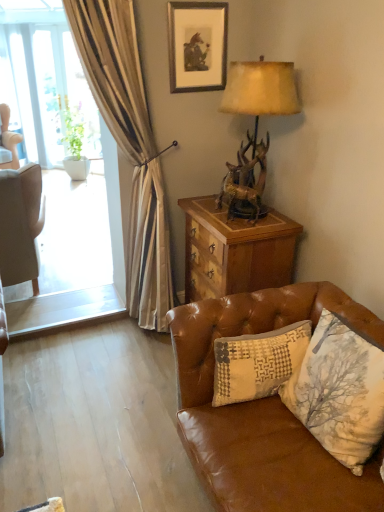
Locate an element on the screen. white fabric chair at left, the second chair when ordered from bottom to top is located at coordinates (9, 139).

From the picture: In order to face antler-patterned wood lamp at upper right, should I rotate leftwards or rightwards?

You should rotate right by 8.635 degrees.

This screenshot has width=384, height=512. I want to click on antler-patterned wood lamp at upper right, so pyautogui.click(x=261, y=90).

What do you see at coordinates (20, 224) in the screenshot?
I see `light brown leather chair at left, which is the second chair from left to right` at bounding box center [20, 224].

The image size is (384, 512). I want to click on matte black picture frame at upper center, so click(x=197, y=46).

The width and height of the screenshot is (384, 512). What do you see at coordinates (263, 410) in the screenshot?
I see `brown leather couch at lower right` at bounding box center [263, 410].

Locate an element on the screen. white fabric chair at left, the second chair when ordered from bottom to top is located at coordinates (9, 139).

Is wooden chest at right inside brown leather couch at lower right?

Actually, wooden chest at right is outside brown leather couch at lower right.

Does brown leather couch at lower right have a larger size compared to wooden chest at right?

Correct, brown leather couch at lower right is larger in size than wooden chest at right.

Is the surface of brown leather couch at lower right in direct contact with wooden chest at right?

No, brown leather couch at lower right is not next to wooden chest at right.

Based on the photo, can you confirm if green leafy plant at left is smaller than light brown leather chair at left, placed as the 1th chair when sorted from right to left?

Yes.

Does green leafy plant at left lie in front of light brown leather chair at left, placed as the 1th chair when sorted from right to left?

No, it is not.

Who is taller, green leafy plant at left or light brown leather chair at left, the first chair in the bottom-to-top sequence?

With more height is green leafy plant at left.

Considering the points (66, 163) and (20, 181), which point is in front, point (66, 163) or point (20, 181)?

The point (20, 181) is in front.

Considering the points (268, 497) and (4, 144), which point is in front, point (268, 497) or point (4, 144)?

The point (268, 497) is more forward.

From a real-world perspective, is brown leather couch at lower right positioned over white fabric chair at left, which is the first chair in left-to-right order, based on gravity?

No, from a real-world perspective, brown leather couch at lower right is not above white fabric chair at left, which is the first chair in left-to-right order.

Is brown leather couch at lower right taller or shorter than white fabric chair at left, the 1th chair positioned from the back?

Considering their sizes, brown leather couch at lower right has less height than white fabric chair at left, the 1th chair positioned from the back.

Which object is more forward, brown leather couch at lower right or white fabric chair at left, the second chair viewed from the right?

brown leather couch at lower right is in front.

Measure the distance between patchwork fabric pillow at lower right and wooden chest at right.

patchwork fabric pillow at lower right and wooden chest at right are 24.42 inches apart from each other.

From the image's perspective, relative to wooden chest at right, is patchwork fabric pillow at lower right above or below?

Clearly, from the image's perspective, patchwork fabric pillow at lower right is below wooden chest at right.

Locate an element on the screen. The image size is (384, 512). pillow in front of the wooden chest at right is located at coordinates (257, 362).

Which object is further away from the camera taking this photo, patchwork fabric pillow at lower right or wooden chest at right?

wooden chest at right is behind.

Where is `picture frame that appears above the light brown leather chair at left, which ranks as the 2th chair in back-to-front order (from a real-world perspective)`? This screenshot has width=384, height=512. picture frame that appears above the light brown leather chair at left, which ranks as the 2th chair in back-to-front order (from a real-world perspective) is located at coordinates (197, 46).

Is matte black picture frame at upper center beside light brown leather chair at left, placed as the 1th chair when sorted from right to left?

No, matte black picture frame at upper center is not making contact with light brown leather chair at left, placed as the 1th chair when sorted from right to left.

Could you measure the distance between matte black picture frame at upper center and light brown leather chair at left, which is the second chair from left to right?

4.41 feet.

Can you confirm if matte black picture frame at upper center is bigger than light brown leather chair at left, the first chair in the bottom-to-top sequence?

Incorrect, matte black picture frame at upper center is not larger than light brown leather chair at left, the first chair in the bottom-to-top sequence.

Does brown leather couch at lower right contain antler-patterned wood lamp at upper right?

Definitely not — antler-patterned wood lamp at upper right is not inside brown leather couch at lower right.

From a real-world perspective, who is located higher, brown leather couch at lower right or antler-patterned wood lamp at upper right?

antler-patterned wood lamp at upper right.

In terms of width, does brown leather couch at lower right look wider or thinner when compared to antler-patterned wood lamp at upper right?

In the image, brown leather couch at lower right appears to be wider than antler-patterned wood lamp at upper right.

From the picture: Is brown leather couch at lower right beside antler-patterned wood lamp at upper right?

brown leather couch at lower right and antler-patterned wood lamp at upper right are clearly separated.

What are the coordinates of `picture frame behind the antler-patterned wood lamp at upper right` in the screenshot? It's located at (197, 46).

Does matte black picture frame at upper center have a lesser height compared to antler-patterned wood lamp at upper right?

Yes.

Does matte black picture frame at upper center lie in front of antler-patterned wood lamp at upper right?

No, it is behind antler-patterned wood lamp at upper right.

Locate an element on the screen. desk above the brown leather couch at lower right (from a real-world perspective) is located at coordinates (235, 250).

Locate an element on the screen. houseplant that appears above the light brown leather chair at left, the 2th chair when ordered from top to bottom (from the image's perspective) is located at coordinates (74, 143).

Looking at the image, which one is located further to green leafy plant at left, antler-patterned wood lamp at upper right or white fabric chair at left, which is the first chair in left-to-right order?

antler-patterned wood lamp at upper right is positioned further to the anchor green leafy plant at left.

Looking at the image, which one is located closer to matte black picture frame at upper center, white fabric chair at left, the 1th chair when ordered from top to bottom, or brown leather couch at lower right?

brown leather couch at lower right.

When comparing their distances from antler-patterned wood lamp at upper right, does patchwork fabric pillow at lower right or light brown leather chair at left, the first chair in the bottom-to-top sequence, seem closer?

patchwork fabric pillow at lower right is positioned closer to the anchor antler-patterned wood lamp at upper right.

Considering their positions, is brown leather couch at lower right positioned further to matte black picture frame at upper center than light brown leather chair at left, which ranks as the 2th chair in back-to-front order?

The object further to matte black picture frame at upper center is brown leather couch at lower right.

In the scene shown: Which object lies nearer to the anchor point light brown leather chair at left, the first chair in the bottom-to-top sequence, antler-patterned wood lamp at upper right or white fabric chair at left, which is the first chair in left-to-right order?

antler-patterned wood lamp at upper right is positioned closer to the anchor light brown leather chair at left, the first chair in the bottom-to-top sequence.

Estimate the real-world distances between objects in this image. Which object is closer to wooden chest at right, brown leather couch at lower right or green leafy plant at left?

brown leather couch at lower right.

When comparing their distances from matte black picture frame at upper center, does patchwork fabric pillow at lower right or green leafy plant at left seem closer?

The object closer to matte black picture frame at upper center is patchwork fabric pillow at lower right.

From the image, which object appears to be nearer to white fabric chair at left, arranged as the 2th chair when viewed from the front, patchwork fabric pillow at lower right or light brown leather chair at left, which is the second chair from left to right?

Based on the image, light brown leather chair at left, which is the second chair from left to right, appears to be nearer to white fabric chair at left, arranged as the 2th chair when viewed from the front.

Locate an element on the screen. This screenshot has width=384, height=512. desk between antler-patterned wood lamp at upper right and green leafy plant at left along the z-axis is located at coordinates (235, 250).

I want to click on pillow located between brown leather couch at lower right and wooden chest at right in the depth direction, so click(257, 362).

Find the location of a particular element. lamp that lies between matte black picture frame at upper center and patchwork fabric pillow at lower right from top to bottom is located at coordinates (261, 90).

Where is `desk between antler-patterned wood lamp at upper right and patchwork fabric pillow at lower right from top to bottom`? This screenshot has width=384, height=512. desk between antler-patterned wood lamp at upper right and patchwork fabric pillow at lower right from top to bottom is located at coordinates (235, 250).